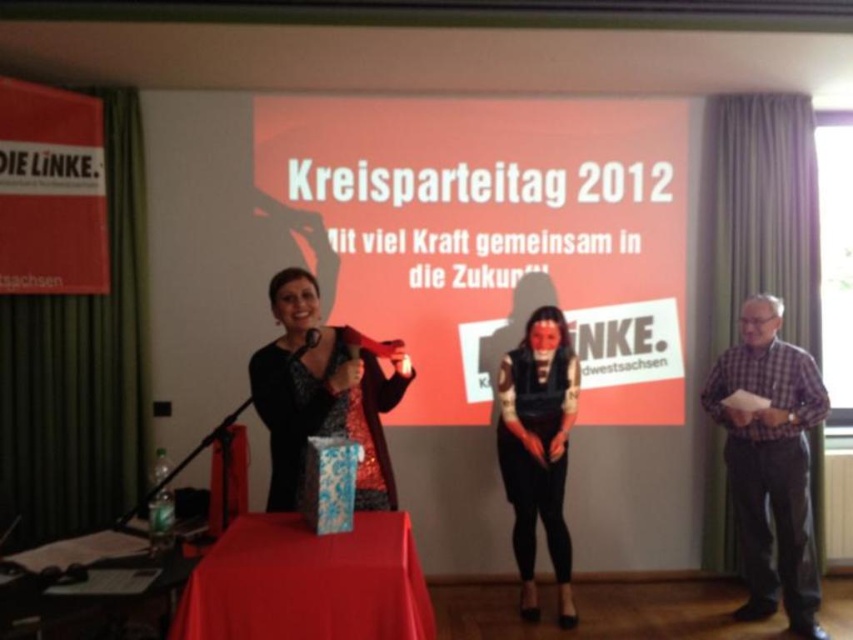
Is smooth red tablecloth at center positioned at the back of smooth wooden table at lower left?

Yes.

Measure the distance between smooth red tablecloth at center and camera.

smooth red tablecloth at center and camera are 2.09 meters apart.

Identify the location of smooth red tablecloth at center. (306, 582).

Is plaid fabric shirt at right thinner than smooth wooden table at lower left?

Indeed, plaid fabric shirt at right has a lesser width compared to smooth wooden table at lower left.

Is point (785, 410) positioned before point (73, 624)?

That is False.

The width and height of the screenshot is (853, 640). What do you see at coordinates (770, 461) in the screenshot?
I see `plaid fabric shirt at right` at bounding box center [770, 461].

You are a GUI agent. You are given a task and a screenshot of the screen. Output one action in this format:
    pyautogui.click(x=<x>, y=<y>)
    Task: Click on the plaid fabric shirt at right
    The height and width of the screenshot is (640, 853).
    Given the screenshot: What is the action you would take?
    pyautogui.click(x=770, y=461)

Is black sequined dress at center positioned at the back of matte black mask at center?

No.

Is black sequined dress at center wider than matte black mask at center?

Yes, black sequined dress at center is wider than matte black mask at center.

Where is `black sequined dress at center`? The height and width of the screenshot is (640, 853). black sequined dress at center is located at coordinates (321, 396).